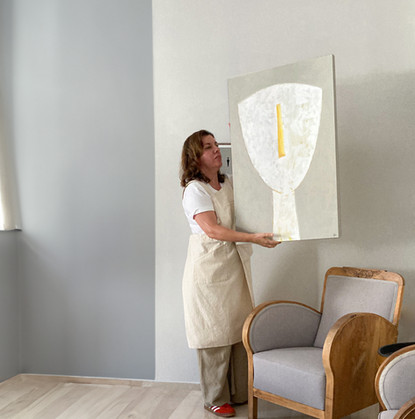
Locate an element on the screen. Image resolution: width=415 pixels, height=419 pixels. curtain is located at coordinates (7, 226).